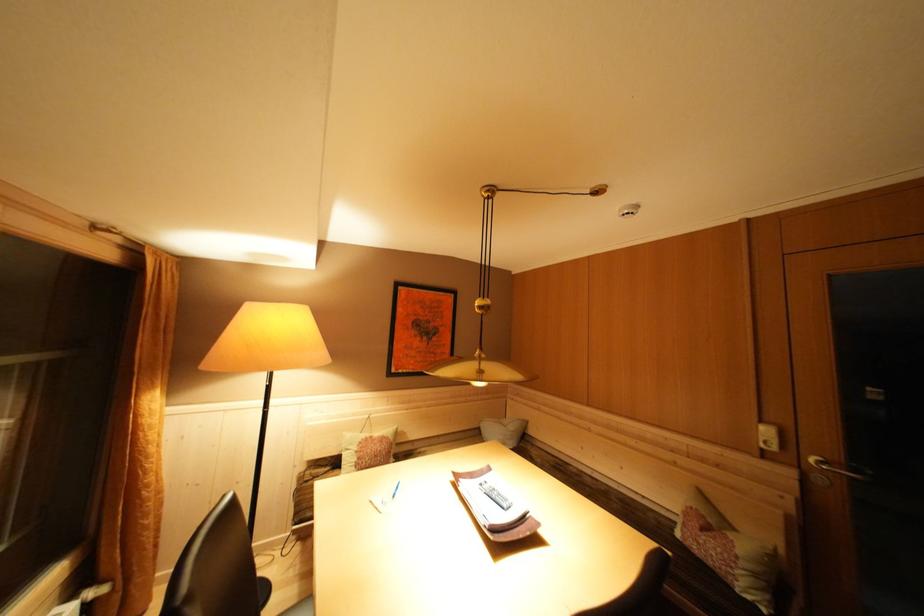
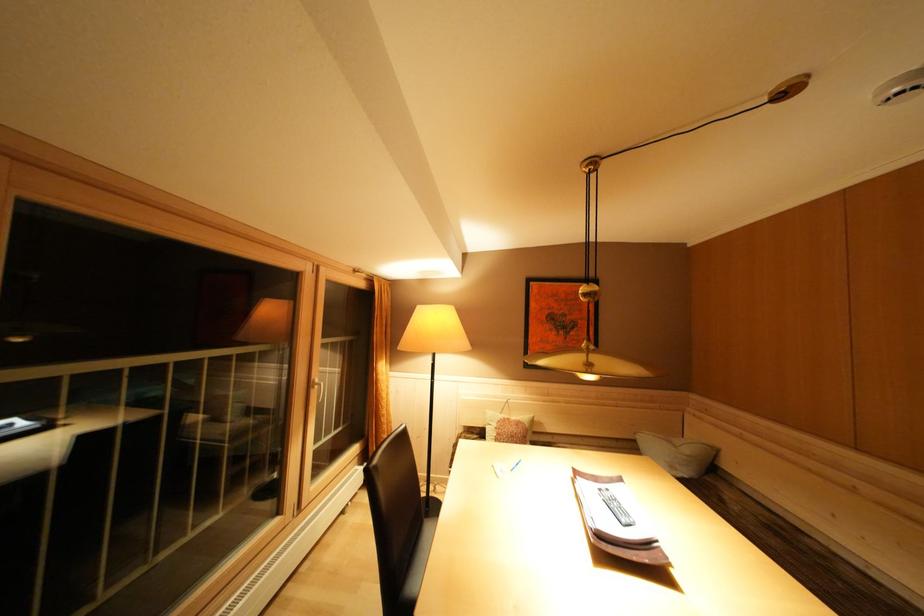
Find the pixel in the second image that matches the point at 488,488 in the first image.

(608, 495)